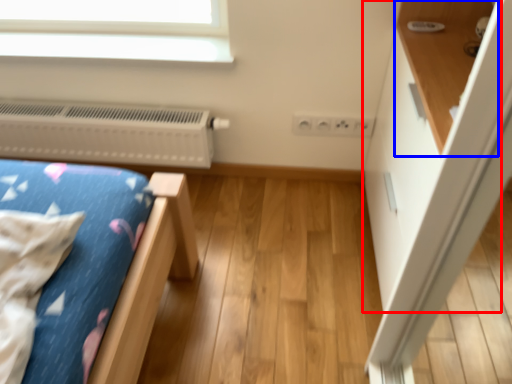
Question: Among these objects, which one is farthest to the camera, dresser (highlighted by a red box) or shelf (highlighted by a blue box)?

Choices:
 (A) dresser
 (B) shelf

Answer: (A)